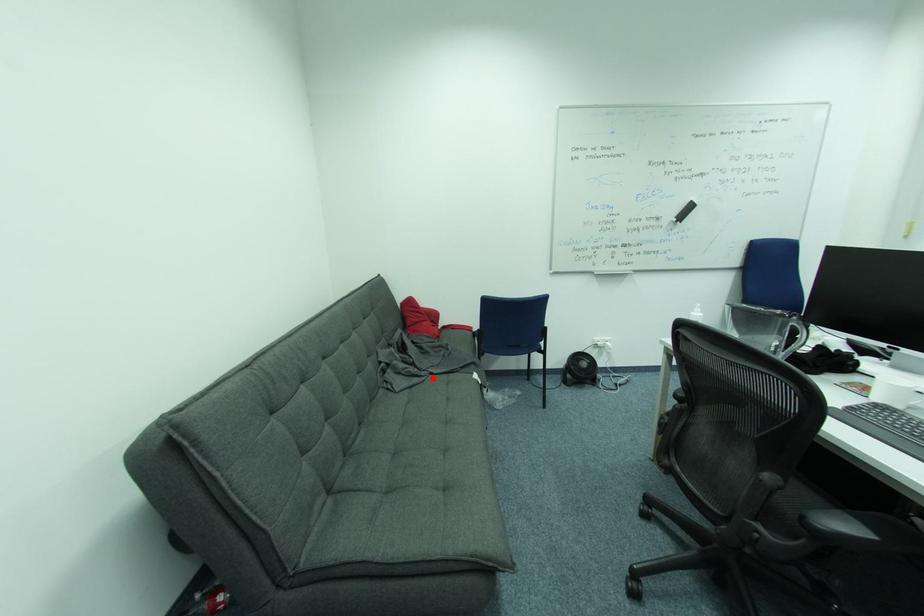
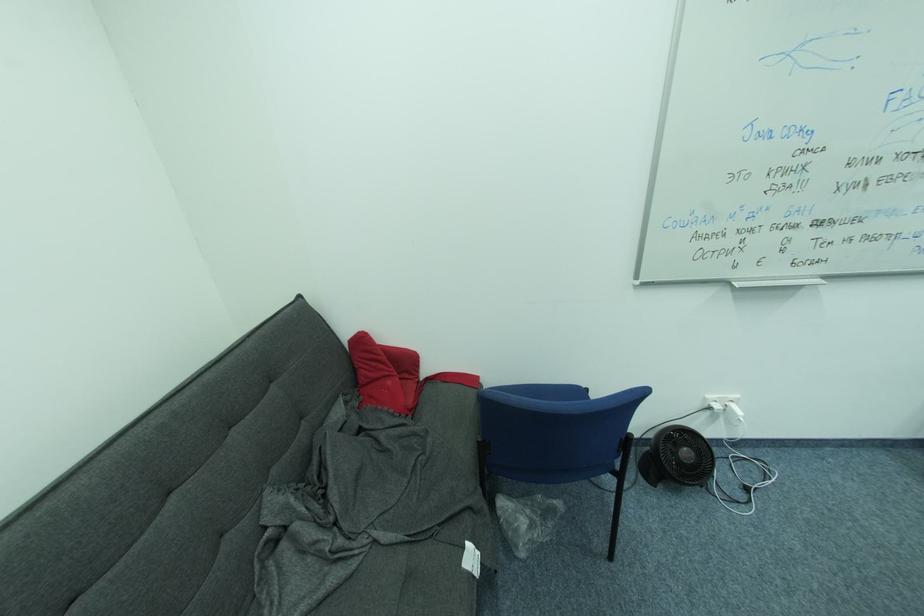
In the second image, find the point that corresponds to the highlighted location in the first image.

(368, 559)